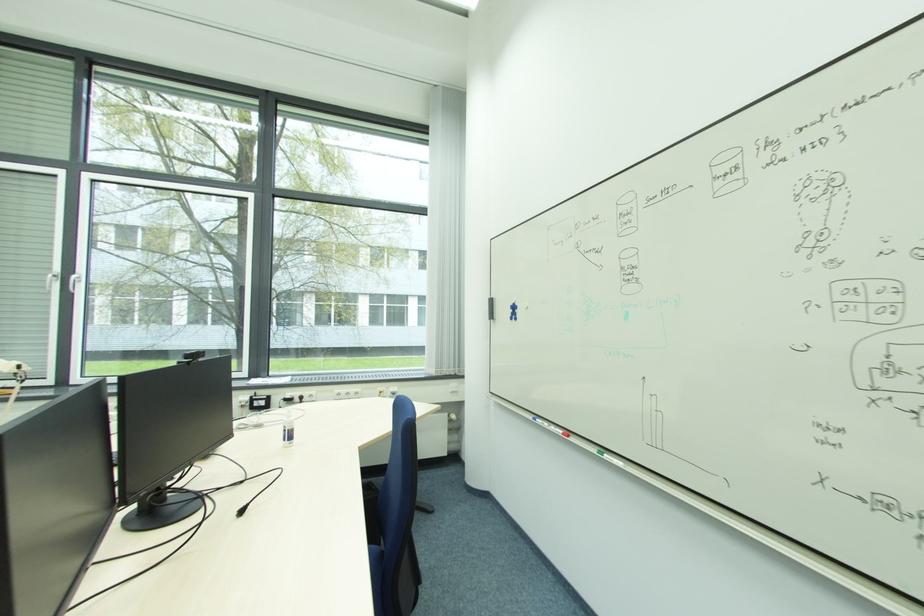
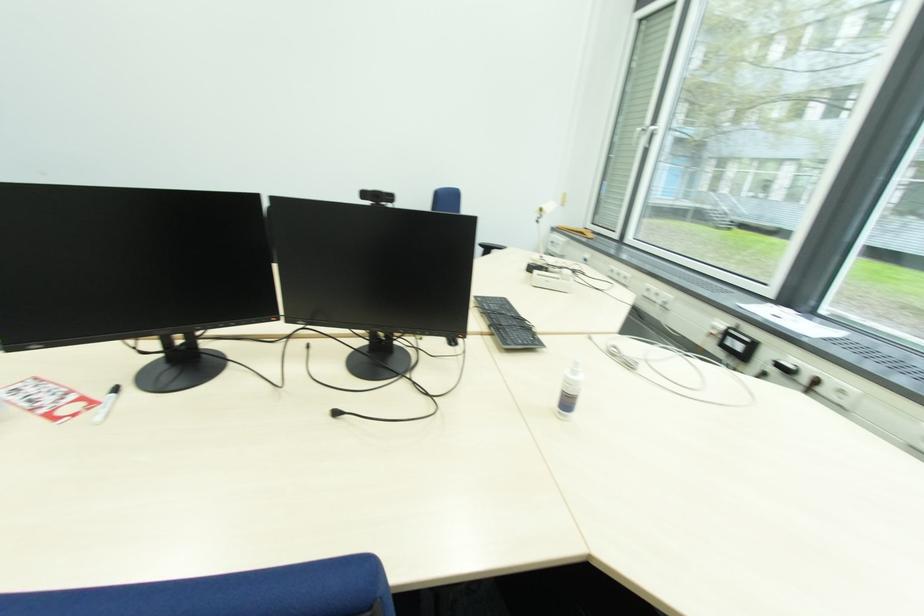
Locate, in the second image, the point that corresponds to pixel 258 400 in the first image.

(734, 333)